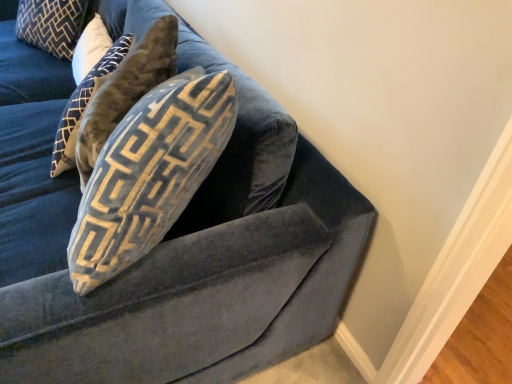
Identify the location of velvet couch at upper right. (x=162, y=257).

Measure the distance between point (240, 143) and camera.

Point (240, 143) is 38.90 inches from camera.

Where is `velvet blue pillow at upper left, marked as the 2th pillow in a left-to-right arrangement`? velvet blue pillow at upper left, marked as the 2th pillow in a left-to-right arrangement is located at coordinates (126, 91).

Locate an element on the screen. This screenshot has height=384, width=512. velvet blue pillow at upper left, the first pillow positioned from the top is located at coordinates (51, 25).

This screenshot has height=384, width=512. Find the location of `velvet couch at upper right`. velvet couch at upper right is located at coordinates (162, 257).

Does point (346, 231) come behind point (170, 25)?

No, (346, 231) is closer to viewer.

How many degrees apart are the facing directions of velvet couch at upper right and velvet blue pillow at upper left, marked as the 2th pillow in a left-to-right arrangement?

The angle between the facing direction of velvet couch at upper right and the facing direction of velvet blue pillow at upper left, marked as the 2th pillow in a left-to-right arrangement, is 0.734 degrees.

Does velvet couch at upper right turn towards velvet blue pillow at upper left, marked as the 2th pillow in a left-to-right arrangement?

Yes, velvet couch at upper right is facing velvet blue pillow at upper left, marked as the 2th pillow in a left-to-right arrangement.

From the image's perspective, would you say velvet couch at upper right is positioned over velvet blue pillow at upper left, acting as the 2th pillow starting from the back?

Indeed, from the image's perspective, velvet couch at upper right is shown above velvet blue pillow at upper left, acting as the 2th pillow starting from the back.

Looking at this image, is velvet couch at upper right beside velvet blue pillow at upper left, the first pillow from the back?

There is a gap between velvet couch at upper right and velvet blue pillow at upper left, the first pillow from the back.

Looking at this image, is velvet couch at upper right not within velvet blue pillow at upper left, which is the 2th pillow from bottom to top?

Yes.

Does point (82, 376) come farther from viewer compared to point (57, 39)?

No, it is not.

Considering the relative sizes of velvet couch at upper right and velvet blue pillow at upper left, the 2th pillow viewed from the right, in the image provided, is velvet couch at upper right smaller than velvet blue pillow at upper left, the 2th pillow viewed from the right,?

Actually, velvet couch at upper right might be larger than velvet blue pillow at upper left, the 2th pillow viewed from the right.

Is velvet blue pillow at upper left, acting as the 2th pillow starting from the back, next to velvet blue pillow at upper left, the 2th pillow viewed from the right, and touching it?

They are not placed beside each other.

Could velvet blue pillow at upper left, the first pillow from the back, be considered to be inside velvet blue pillow at upper left, marked as the 2th pillow in a left-to-right arrangement?

Definitely not — velvet blue pillow at upper left, the first pillow from the back, is not inside velvet blue pillow at upper left, marked as the 2th pillow in a left-to-right arrangement.

In terms of height, does velvet blue pillow at upper left, acting as the 2th pillow starting from the back, look taller or shorter compared to velvet blue pillow at upper left, which is counted as the 2th pillow, starting from the front?

Considering their sizes, velvet blue pillow at upper left, acting as the 2th pillow starting from the back, has more height than velvet blue pillow at upper left, which is counted as the 2th pillow, starting from the front.

Based on the photo, would you say velvet blue pillow at upper left, the 2th pillow viewed from the right, is inside or outside velvet couch at upper right?

The correct answer is: inside.

Which of these two, velvet blue pillow at upper left, the first pillow from the back, or velvet couch at upper right, is bigger?

velvet couch at upper right is bigger.

Is velvet blue pillow at upper left, the first pillow positioned from the top, not near velvet couch at upper right?

Indeed, velvet blue pillow at upper left, the first pillow positioned from the top, is not near velvet couch at upper right.

Which of these two, velvet blue pillow at upper left, the first pillow from the back, or velvet couch at upper right, stands shorter?

With less height is velvet blue pillow at upper left, the first pillow from the back.

Is velvet blue pillow at upper left, which is the 1th pillow from left to right, completely or partially outside of velvet blue pillow at upper left, the 2th pillow in the top-to-bottom sequence?

That's correct, velvet blue pillow at upper left, which is the 1th pillow from left to right, is outside of velvet blue pillow at upper left, the 2th pillow in the top-to-bottom sequence.

Is velvet blue pillow at upper left, which is the 1th pillow from left to right, looking in the opposite direction of velvet blue pillow at upper left, marked as the 2th pillow in a left-to-right arrangement?

No, velvet blue pillow at upper left, marked as the 2th pillow in a left-to-right arrangement, is not at the back of velvet blue pillow at upper left, which is the 1th pillow from left to right.

From the image's perspective, does velvet blue pillow at upper left, which is counted as the 2th pillow, starting from the front, appear lower than velvet blue pillow at upper left, marked as the 2th pillow in a left-to-right arrangement?

Actually, velvet blue pillow at upper left, which is counted as the 2th pillow, starting from the front, appears above velvet blue pillow at upper left, marked as the 2th pillow in a left-to-right arrangement, in the image.

Between velvet blue pillow at upper left, the first pillow from the back, and velvet blue pillow at upper left, marked as the 2th pillow in a left-to-right arrangement, which one has larger size?

velvet blue pillow at upper left, marked as the 2th pillow in a left-to-right arrangement.

From the image's perspective, between velvet blue pillow at upper left, the 1th pillow positioned from the front, and velvet couch at upper right, who is located below?

velvet blue pillow at upper left, the 1th pillow positioned from the front, appears lower in the image.

Considering the relative sizes of velvet blue pillow at upper left, which is the first pillow from bottom to top, and velvet couch at upper right in the image provided, is velvet blue pillow at upper left, which is the first pillow from bottom to top, bigger than velvet couch at upper right?

Incorrect, velvet blue pillow at upper left, which is the first pillow from bottom to top, is not larger than velvet couch at upper right.

Is velvet blue pillow at upper left, acting as the 2th pillow starting from the back, taller or shorter than velvet couch at upper right?

In the image, velvet blue pillow at upper left, acting as the 2th pillow starting from the back, appears to be shorter than velvet couch at upper right.

You are a GUI agent. You are given a task and a screenshot of the screen. Output one action in this format:
    pyautogui.click(x=<x>, y=<y>)
    Task: Click on the pillow on the right of velvet couch at upper right
    The image size is (512, 384).
    Given the screenshot: What is the action you would take?
    pyautogui.click(x=126, y=91)

Where is `the 1st pillow positioned above the velvet couch at upper right (from a real-world perspective)`? This screenshot has height=384, width=512. the 1st pillow positioned above the velvet couch at upper right (from a real-world perspective) is located at coordinates (51, 25).

Estimate the real-world distances between objects in this image. Which object is further from velvet blue pillow at upper left, marked as the 2th pillow in a left-to-right arrangement, velvet blue pillow at upper left, which is counted as the 2th pillow, starting from the front, or velvet couch at upper right?

velvet blue pillow at upper left, which is counted as the 2th pillow, starting from the front, lies further to velvet blue pillow at upper left, marked as the 2th pillow in a left-to-right arrangement, than the other object.

Which object lies further to the anchor point velvet blue pillow at upper left, which is counted as the 2th pillow, starting from the front, velvet blue pillow at upper left, the 2th pillow in the top-to-bottom sequence, or velvet couch at upper right?

velvet couch at upper right is further to velvet blue pillow at upper left, which is counted as the 2th pillow, starting from the front.

From the image, which object appears to be farther from velvet blue pillow at upper left, the first pillow positioned from the top, velvet couch at upper right or velvet blue pillow at upper left, which is the first pillow from bottom to top?

velvet couch at upper right is further to velvet blue pillow at upper left, the first pillow positioned from the top.

Which object lies nearer to the anchor point velvet couch at upper right, velvet blue pillow at upper left, which is the 2th pillow from bottom to top, or velvet blue pillow at upper left, acting as the 2th pillow starting from the back?

Among the two, velvet blue pillow at upper left, acting as the 2th pillow starting from the back, is located nearer to velvet couch at upper right.

From the image, which object appears to be farther from velvet couch at upper right, velvet blue pillow at upper left, acting as the first pillow starting from the right, or velvet blue pillow at upper left, the first pillow from the back?

velvet blue pillow at upper left, the first pillow from the back, is further to velvet couch at upper right.

Looking at the image, which one is located closer to velvet blue pillow at upper left, marked as the 2th pillow in a left-to-right arrangement, velvet couch at upper right or velvet blue pillow at upper left, which is the 1th pillow from left to right?

velvet couch at upper right is closer to velvet blue pillow at upper left, marked as the 2th pillow in a left-to-right arrangement.

Where is `pillow positioned between velvet couch at upper right and velvet blue pillow at upper left, which is counted as the 2th pillow, starting from the front, from near to far`? pillow positioned between velvet couch at upper right and velvet blue pillow at upper left, which is counted as the 2th pillow, starting from the front, from near to far is located at coordinates (126, 91).